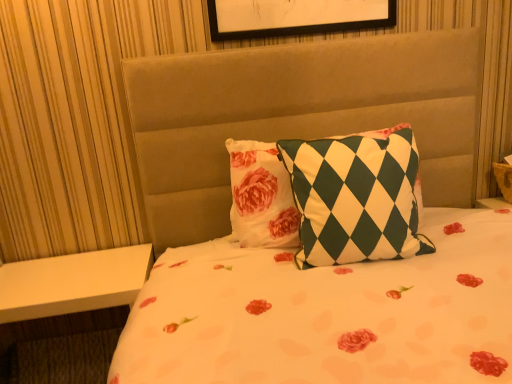
Question: From a real-world perspective, relative to green and white checkered pillow at center, is white matte table at lower left vertically above or below?

Choices:
 (A) below
 (B) above

Answer: (A)

Question: Is white matte table at lower left to the left or to the right of green and white checkered pillow at center in the image?

Choices:
 (A) left
 (B) right

Answer: (A)

Question: Is white matte table at lower left bigger or smaller than green and white checkered pillow at center?

Choices:
 (A) big
 (B) small

Answer: (A)

Question: Considering the positions of point (394, 200) and point (78, 292), is point (394, 200) closer or farther from the camera than point (78, 292)?

Choices:
 (A) closer
 (B) farther

Answer: (A)

Question: Is green and white checkered pillow at center in front of or behind white matte table at lower left in the image?

Choices:
 (A) front
 (B) behind

Answer: (A)

Question: Looking at their shapes, would you say green and white checkered pillow at center is wider or thinner than white matte table at lower left?

Choices:
 (A) thin
 (B) wide

Answer: (A)

Question: Looking at the image, does green and white checkered pillow at center seem bigger or smaller compared to white matte table at lower left?

Choices:
 (A) big
 (B) small

Answer: (B)